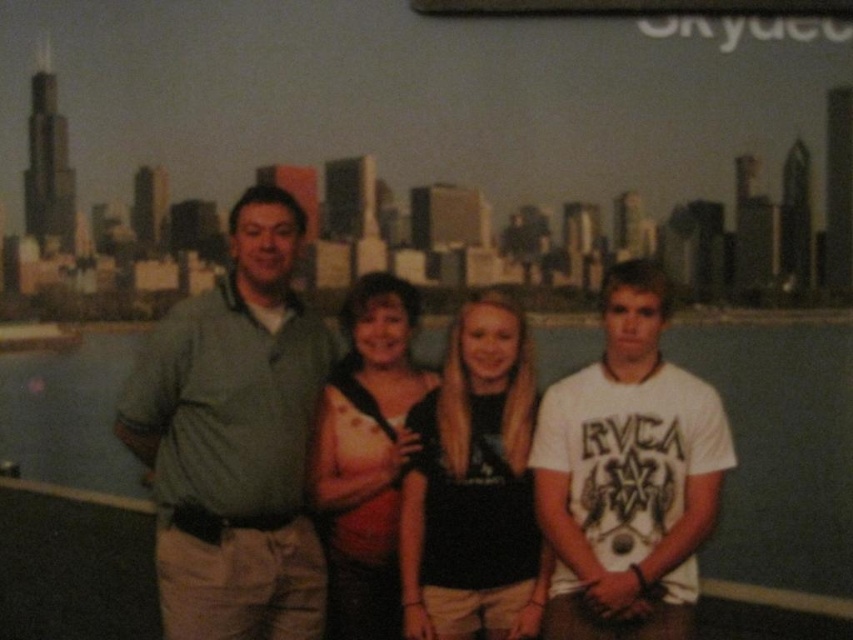
Based on the photo, is matte green shirt at center further to camera compared to satin black dress at center?

No, it is in front of satin black dress at center.

From the picture: Who is more forward, (529,538) or (401,444)?

Point (529,538) is more forward.

The image size is (853, 640). What do you see at coordinates (566, 481) in the screenshot? I see `matte green shirt at center` at bounding box center [566, 481].

In order to click on matte green shirt at center in this screenshot , I will do `click(566, 481)`.

Does green cotton polo shirt at left have a larger size compared to white cotton t-shirt at center?

Yes, green cotton polo shirt at left is bigger than white cotton t-shirt at center.

Who is lower down, green cotton polo shirt at left or white cotton t-shirt at center?

white cotton t-shirt at center

Does point (225, 481) come farther from viewer compared to point (576, 502)?

Yes, point (225, 481) is behind point (576, 502).

Where is `green cotton polo shirt at left`? green cotton polo shirt at left is located at coordinates (235, 440).

Is green cotton polo shirt at left to the left of black matte shirt at center from the viewer's perspective?

Yes, green cotton polo shirt at left is to the left of black matte shirt at center.

Is point (256, 509) less distant than point (421, 460)?

That is True.

Locate an element on the screen. green cotton polo shirt at left is located at coordinates (235, 440).